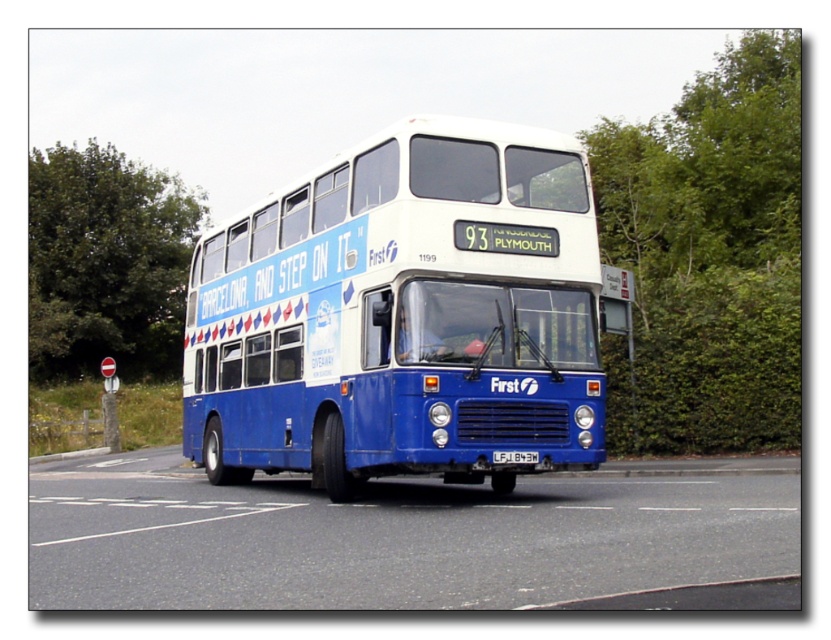
You are standing at the point with coordinates point (48, 353). The bus is moving forward. Will the point point (279, 465) be in front of you as the bus moves?

Yes, because point (279, 465) is in front of point (48, 353) according to the image coordinates.

You are a delivery person who needs to cross the road safely. The blue metallic bus at center is approaching you. If the bus is 9.56 meters away from you, can you safely cross the road before the bus arrives?

The blue metallic bus at center is 9.56 meters away from you. To determine if you can safely cross, consider the bus speed and your crossing time. Without knowing the bus speed, it is impossible to accurately judge. However, 9.56 meters is a significant distance, so it might be safe to cross if the bus is moving slowly. Always check traffic before crossing.

You are a pedestrian standing on the sidewalk and see the blue metallic bus at center and the green leafy tree at left. Which object is closer to you?

The blue metallic bus at center is closer to you because it is in front of the green leafy tree at left, meaning the tree is behind the bus from your perspective.